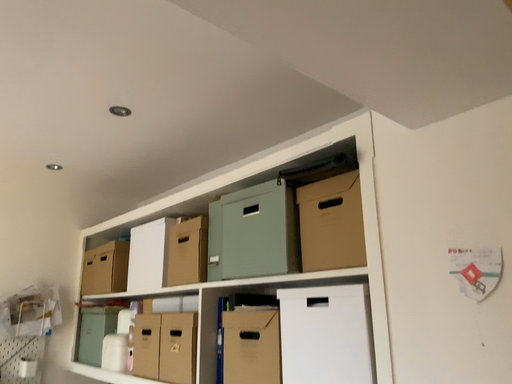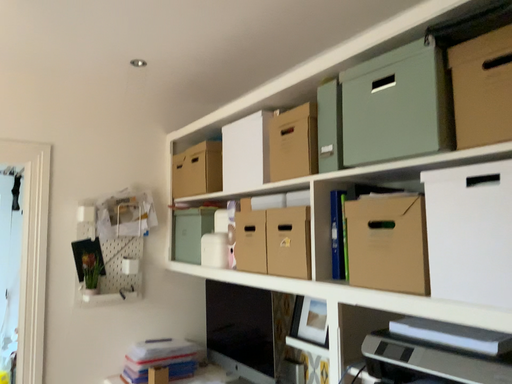
Question: Which way did the camera rotate in the video?

Choices:
 (A) rotated left
 (B) rotated right

Answer: (A)